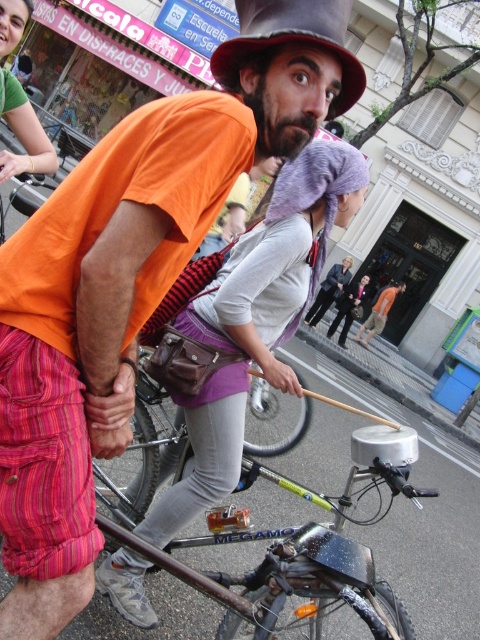
Is shiny metallic hat at center thinner than green fabric shirt at upper left?

No, shiny metallic hat at center is not thinner than green fabric shirt at upper left.

The image size is (480, 640). What are the coordinates of `shiny metallic hat at center` in the screenshot? It's located at (290, 40).

Who is more distant from viewer, (x=337, y=38) or (x=4, y=179)?

Point (x=4, y=179)

Find the location of a particular element. shiny metallic hat at center is located at coordinates (290, 40).

Who is positioned more to the right, silver metallic bicycle at center or shiny metallic hat at center?

From the viewer's perspective, silver metallic bicycle at center appears more on the right side.

Does silver metallic bicycle at center appear over shiny metallic hat at center?

No.

Does point (180, 435) come closer to viewer compared to point (257, 35)?

No, it is behind (257, 35).

Where is `silver metallic bicycle at center`? This screenshot has height=640, width=480. silver metallic bicycle at center is located at coordinates (324, 525).

Can you confirm if silver metallic bicycle at center is taller than green fabric shirt at upper left?

Incorrect, silver metallic bicycle at center's height is not larger of green fabric shirt at upper left's.

Who is more distant from viewer, [358,611] or [40,163]?

The point [40,163] is more distant.

I want to click on silver metallic bicycle at center, so click(324, 525).